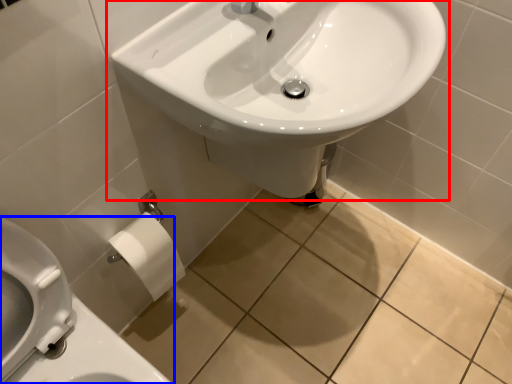
Question: Which point is closer to the camera, sink (highlighted by a red box) or toilet (highlighted by a blue box)?

Choices:
 (A) sink
 (B) toilet

Answer: (B)